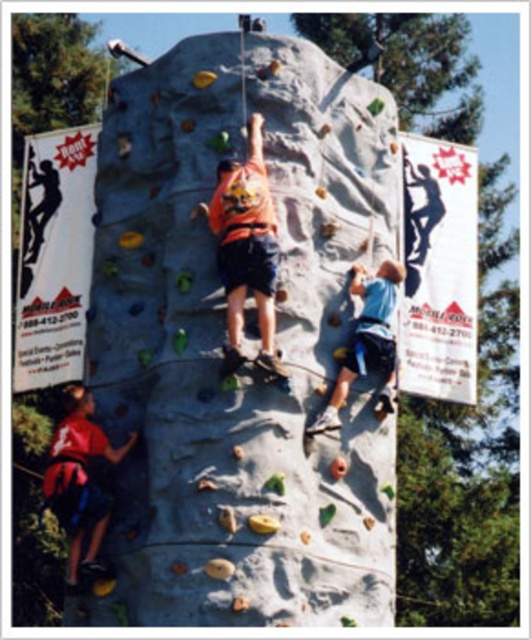
Based on the photo, you are a photographer standing at a certain distance from the smooth gray rock climbing wall at center. You want to capture a photo that includes the entire wall without any distortion. The camera you are using has a standard lens with a focal length of 50mm. Based on the given distance, can you determine if this focal length is suitable for capturing the entire wall in the frame?

The smooth gray rock climbing wall at center is 55.10 meters away from the camera. A standard lens with 50mm focal length is typically suitable for capturing scenes at such distances without significant distortion, so yes, the 50mm focal length should work appropriately.

You are a photographer positioned at the base of the smooth gray rock climbing wall at center. You want to capture a photo of the matte red shirt at lower left without any obstructions. Given the height difference between the two, will the climbing wall block your view of the shirt?

The smooth gray rock climbing wall at center is taller than the matte red shirt at lower left, so the wall will block your view of the shirt.